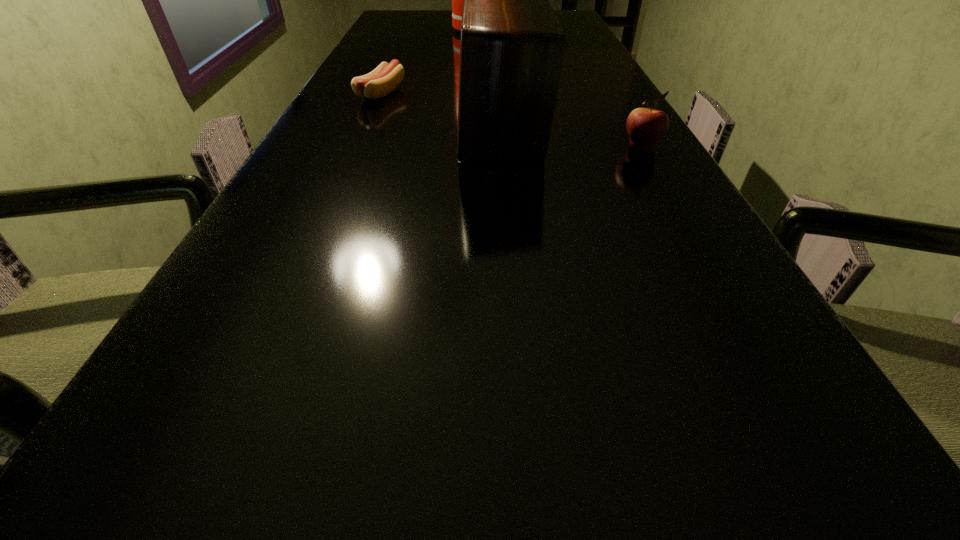
What are the coordinates of `vacant space that satisfies the following two spatial constraints: 1. at the nozzle of the second shortest object; 2. on the left side of the tallest object` in the screenshot? It's located at (466, 149).

Find the location of a particular element. This screenshot has height=540, width=960. free space that satisfies the following two spatial constraints: 1. on the front-facing side of the radio receiver; 2. on the left side of the rightmost object is located at coordinates (503, 149).

This screenshot has width=960, height=540. I want to click on free space that satisfies the following two spatial constraints: 1. at the nozzle of the farthest object; 2. on the right side of the third tallest object, so click(466, 149).

Where is `vacant position in the image that satisfies the following two spatial constraints: 1. on the front-facing side of the third shortest object; 2. on the left side of the apple`? This screenshot has width=960, height=540. vacant position in the image that satisfies the following two spatial constraints: 1. on the front-facing side of the third shortest object; 2. on the left side of the apple is located at coordinates (503, 149).

At what (x,y) coordinates should I click in order to perform the action: click on free region that satisfies the following two spatial constraints: 1. on the front-facing side of the rightmost object; 2. on the left side of the radio receiver. Please return your answer as a coordinate pair (x, y). The width and height of the screenshot is (960, 540). Looking at the image, I should click on (503, 149).

At what (x,y) coordinates should I click in order to perform the action: click on vacant point that satisfies the following two spatial constraints: 1. at the nozzle of the second shortest object; 2. on the right side of the fire extinguisher. Please return your answer as a coordinate pair (x, y). The image size is (960, 540). Looking at the image, I should click on (466, 149).